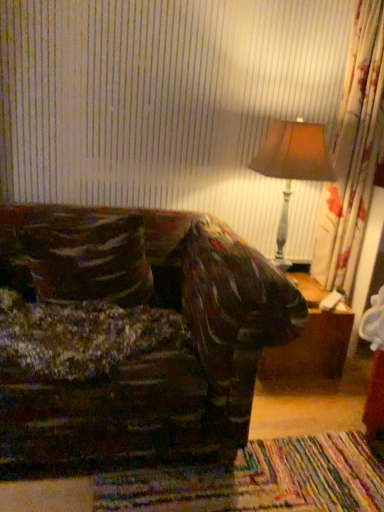
Question: Is velvety brown throw pillow at left inside the boundaries of brown wooden table at lower right, or outside?

Choices:
 (A) outside
 (B) inside

Answer: (A)

Question: Considering the positions of point (56, 281) and point (336, 318), is point (56, 281) closer or farther from the camera than point (336, 318)?

Choices:
 (A) closer
 (B) farther

Answer: (A)

Question: Which of these objects is positioned closest to the velvety brown throw pillow at left?

Choices:
 (A) brown wooden table at lower right
 (B) matte brown lampshade at upper right

Answer: (B)

Question: Estimate the real-world distances between objects in this image. Which object is farther from the brown wooden table at lower right?

Choices:
 (A) matte brown lampshade at upper right
 (B) velvety brown throw pillow at left

Answer: (B)